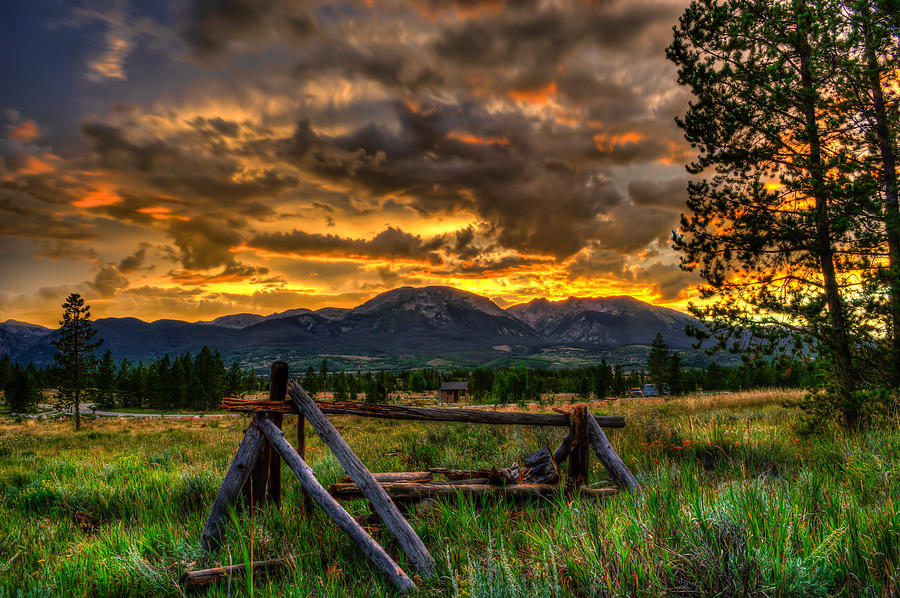
Identify the location of window. (444, 390).